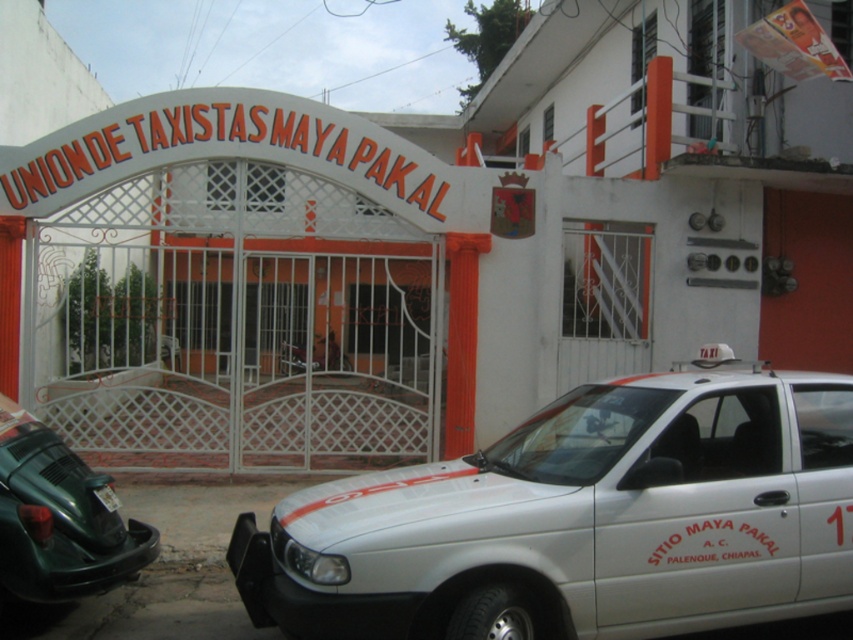
Is white glossy taxi at center shorter than black plastic license plate at lower left?

Incorrect, white glossy taxi at center's height does not fall short of black plastic license plate at lower left's.

The image size is (853, 640). What do you see at coordinates (581, 520) in the screenshot?
I see `white glossy taxi at center` at bounding box center [581, 520].

Identify the location of white glossy taxi at center. Image resolution: width=853 pixels, height=640 pixels. (581, 520).

Is green matte car at lower left taller than black plastic license plate at lower left?

Correct, green matte car at lower left is much taller as black plastic license plate at lower left.

Where is `green matte car at lower left`? green matte car at lower left is located at coordinates (57, 518).

The height and width of the screenshot is (640, 853). What are the coordinates of `green matte car at lower left` in the screenshot? It's located at (57, 518).

Who is more forward, (428, 572) or (67, 480)?

Point (428, 572)

Is point (665, 595) positioned before point (88, 483)?

That is True.

Identify the location of white glossy taxi at center. The height and width of the screenshot is (640, 853). tap(581, 520).